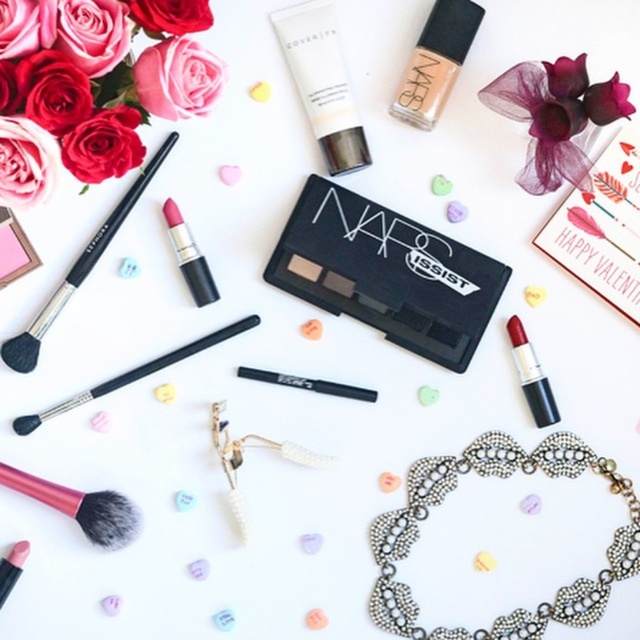
Question: Can you confirm if matte pink lipstick at center is thinner than matte pink lipstick at lower left?

Choices:
 (A) yes
 (B) no

Answer: (B)

Question: Which of the following is the closest to the observer?

Choices:
 (A) (36, 499)
 (B) (212, 339)

Answer: (A)

Question: Can you confirm if matte pink lipstick at center is bigger than matte pink lipstick at lower left?

Choices:
 (A) no
 (B) yes

Answer: (B)

Question: Based on their relative distances, which object is farther from the matte cream foundation at upper center?

Choices:
 (A) velvet-like burgundy flower at upper right
 (B) matte black lipstick at center
 (C) matte black brush at upper left
 (D) black matte makeup brush at center

Answer: (D)

Question: Is velvet-like burgundy flower at upper right bigger than matte black lipstick at center?

Choices:
 (A) no
 (B) yes

Answer: (B)

Question: Which object is positioned closest to the black matte makeup brush at center?

Choices:
 (A) matte cream foundation at upper center
 (B) matte black brush at upper left
 (C) antique silver necklace at center
 (D) matte black lipstick at center

Answer: (B)